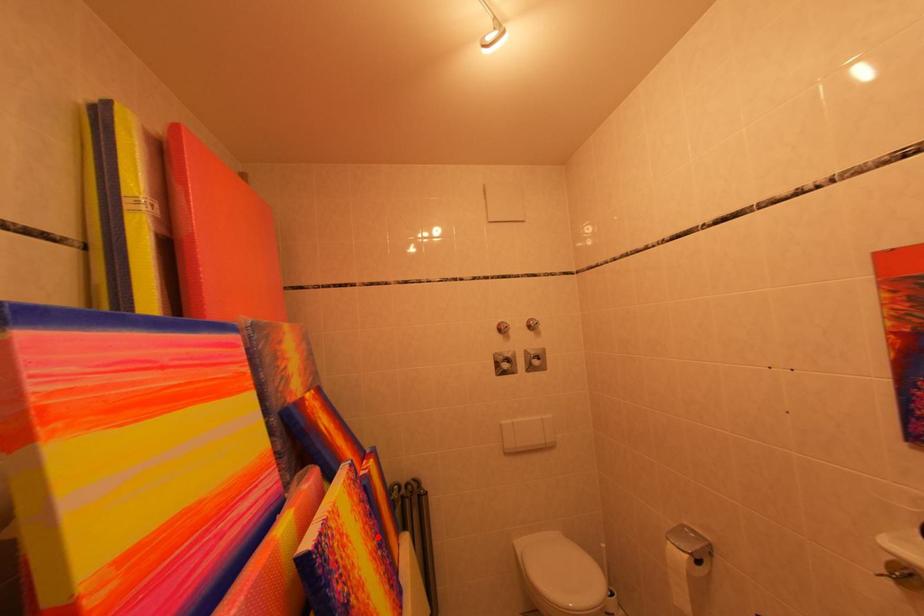
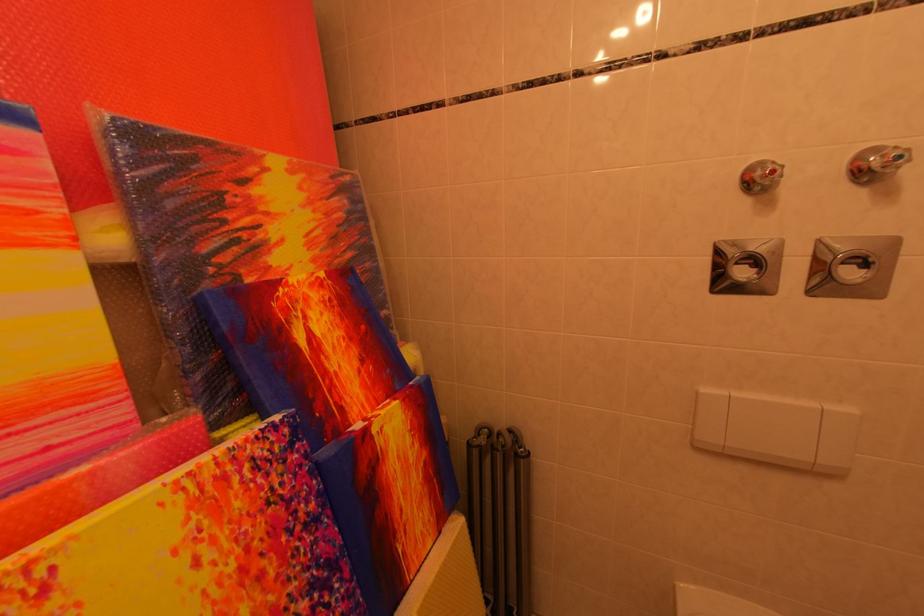
Find the pixel in the second image that matches the highlighted location in the first image.

(281, 575)